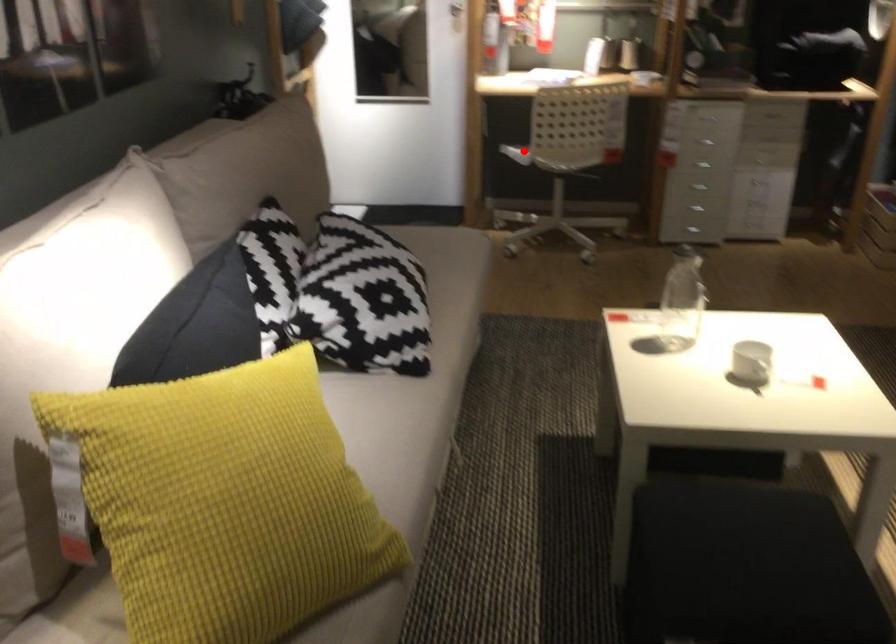
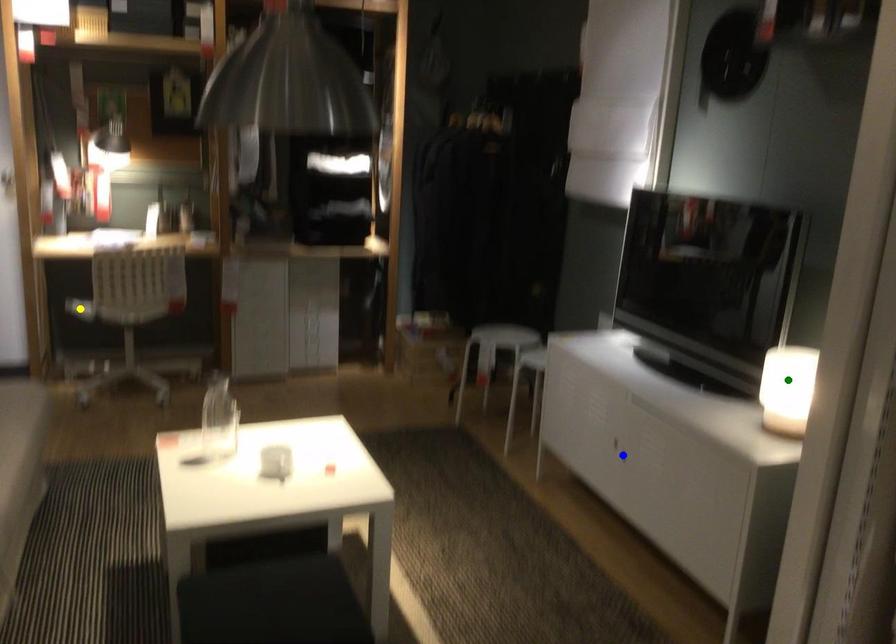
Question: I am providing you with two images of the same scene from different viewpoints. A red point is marked on the first image. You are given multiple points on the second image. Can you choose the point in image 2 that corresponds to the point in image 1?

Choices:
 (A) blue point
 (B) green point
 (C) yellow point

Answer: (C)